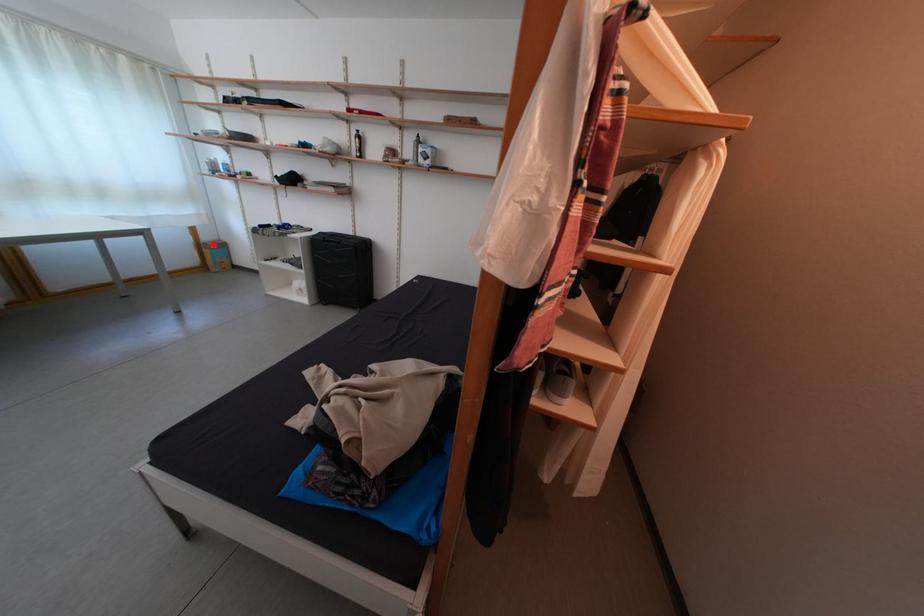
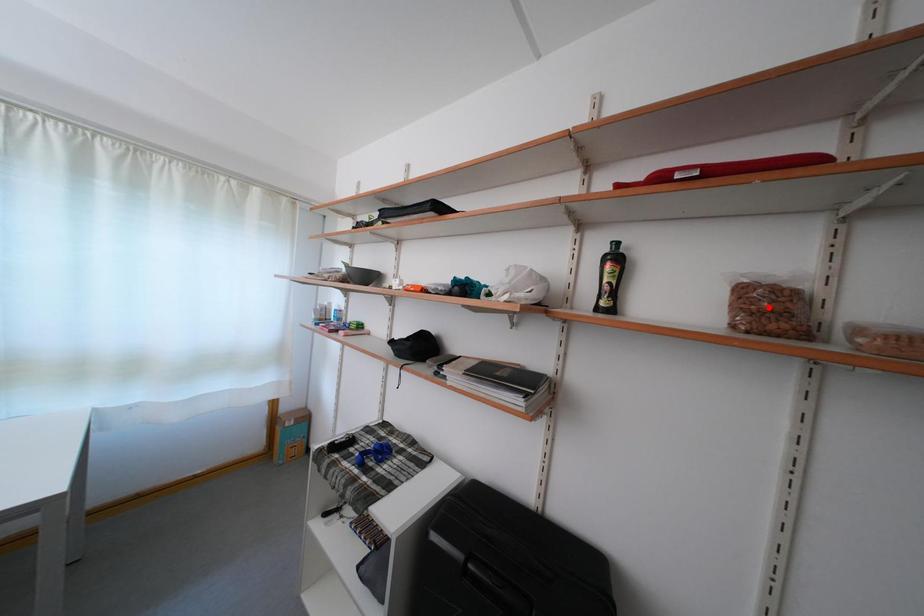
I am providing you with two images of the same scene from different viewpoints. A red point is marked on the first image and another point is marked on the second image. Do the highlighted points in image1 and image2 indicate the same real-world spot?

No